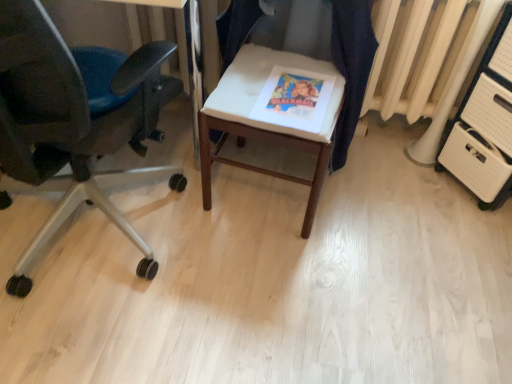
Image resolution: width=512 pixels, height=384 pixels. I want to click on free space that is in between white plastic file cabinet at right and white fabric chair at center, so click(x=389, y=196).